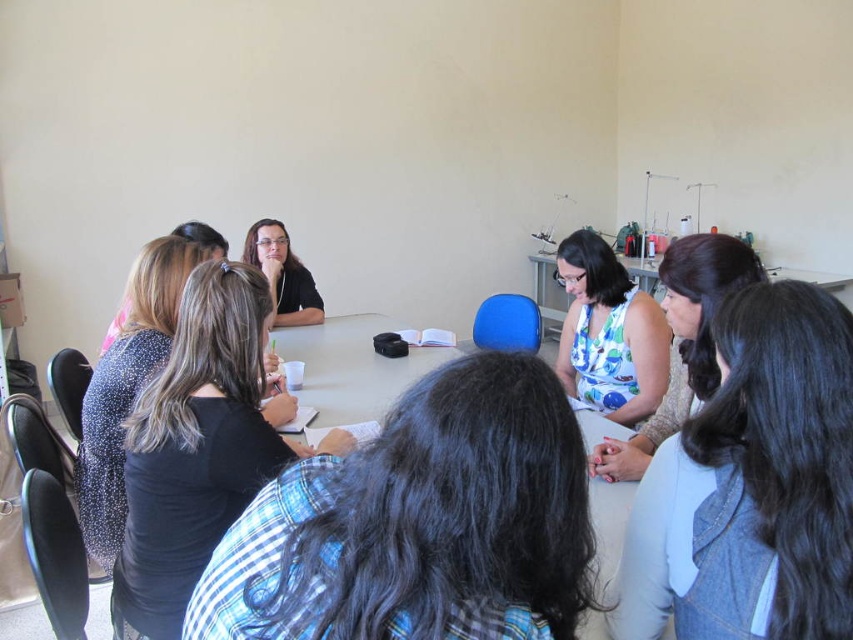
Question: Can you confirm if gray fabric shirt at lower right is bigger than black matte shirt at upper left?

Choices:
 (A) no
 (B) yes

Answer: (A)

Question: Which of the following is the farthest from the observer?

Choices:
 (A) black textured shirt at upper left
 (B) blue floral dress at center
 (C) white plastic table at center
 (D) speckled fabric shirt at left

Answer: (B)

Question: Which of the following is the farthest from the observer?

Choices:
 (A) black textured shirt at upper left
 (B) speckled fabric shirt at left
 (C) gray fabric shirt at lower right
 (D) blue floral dress at center

Answer: (D)

Question: Which object is positioned closest to the black textured shirt at upper left?

Choices:
 (A) black matte shirt at upper left
 (B) blue floral dress at center
 (C) gray fabric shirt at lower right

Answer: (A)

Question: Can you confirm if black matte shirt at upper left is thinner than white plastic table at center?

Choices:
 (A) yes
 (B) no

Answer: (A)

Question: Is black fabric shirt at center bigger than white plastic table at center?

Choices:
 (A) no
 (B) yes

Answer: (A)